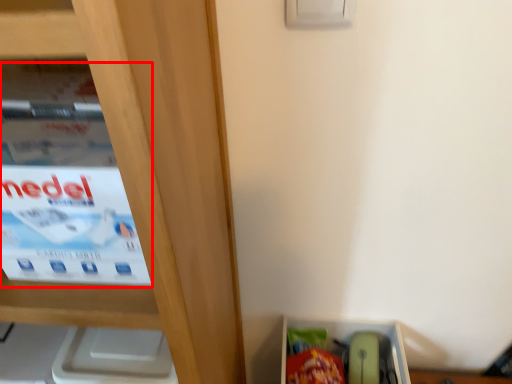
Question: From the image's perspective, what is the correct spatial positioning of paperback book (annotated by the red box) in reference to storage box?

Choices:
 (A) below
 (B) above

Answer: (B)